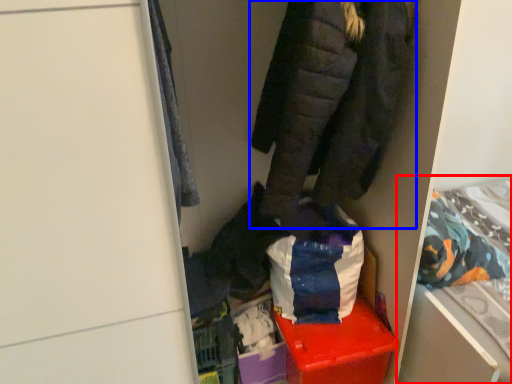
Question: Which point is further to the camera, bed (highlighted by a red box) or jacket (highlighted by a blue box)?

Choices:
 (A) bed
 (B) jacket

Answer: (A)